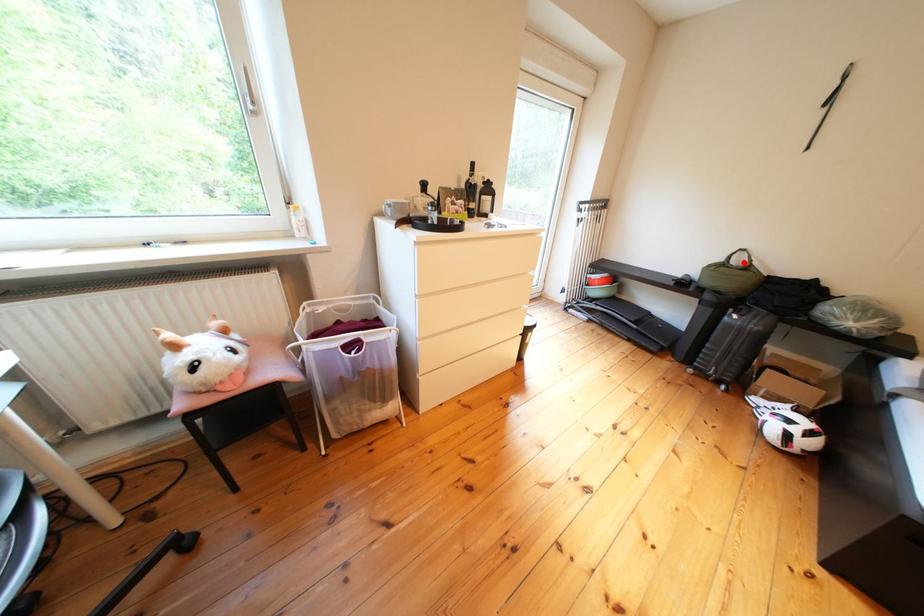
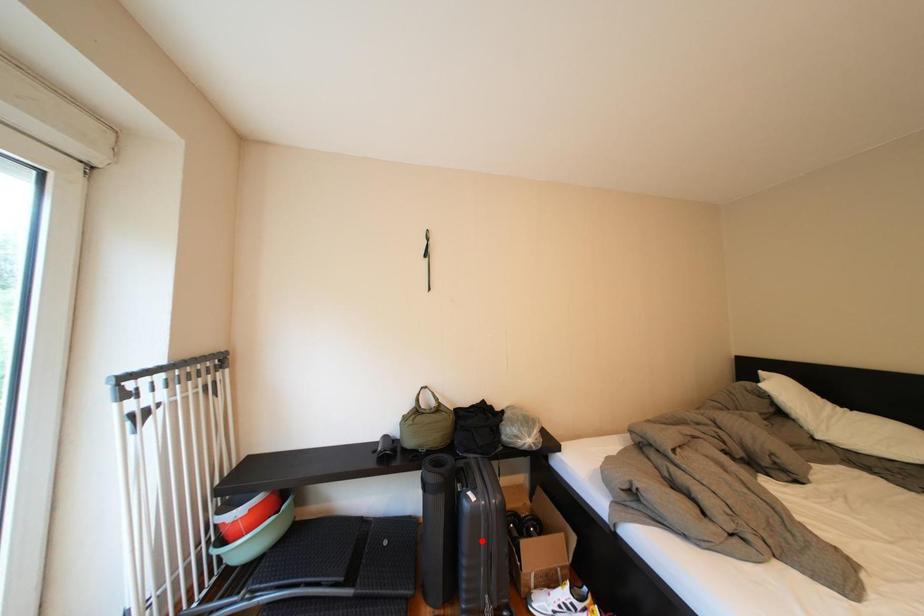
I am providing you with two images of the same scene from different viewpoints. A red point is marked on the first image and another point is marked on the second image. Is the red point in image1 aligned with the point shown in image2?

No